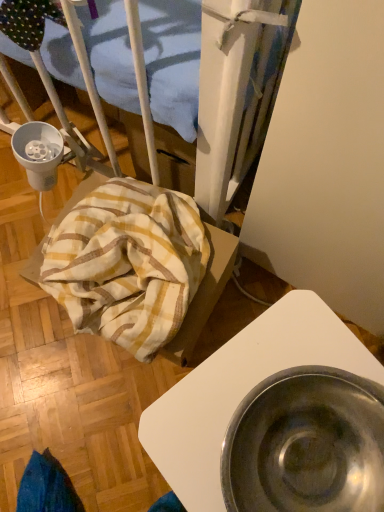
The height and width of the screenshot is (512, 384). I want to click on free space in front of yellow-white striped fabric at lower left, so click(99, 414).